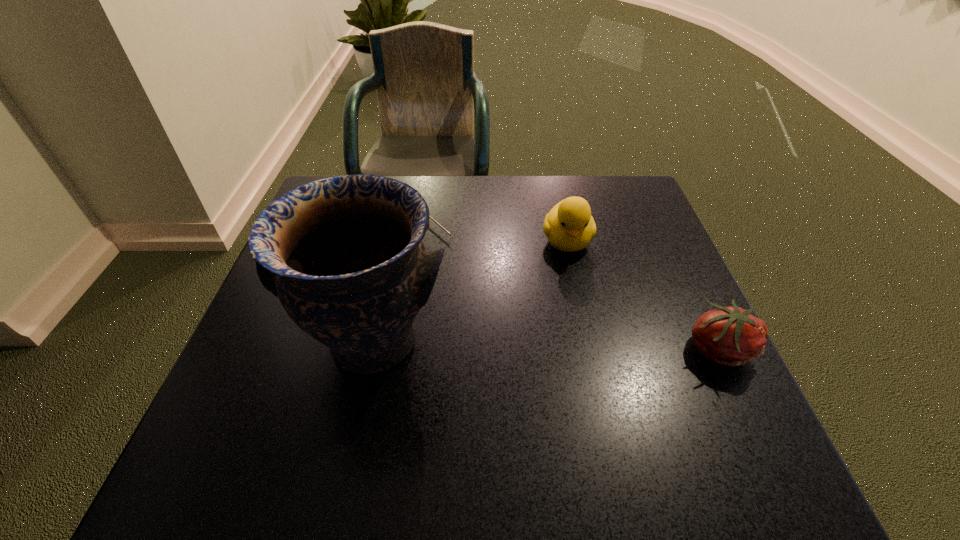
The height and width of the screenshot is (540, 960). In the image, there is a desktop. Find the location of `vacant space at the far right corner`. vacant space at the far right corner is located at coordinates (632, 175).

Identify the location of unoccupied position between the second shortest object and the tallest object. Image resolution: width=960 pixels, height=540 pixels. (546, 345).

At what (x,y) coordinates should I click in order to perform the action: click on unoccupied position between the second tallest object and the shortest object. Please return your answer as a coordinate pair (x, y). The image size is (960, 540). Looking at the image, I should click on (493, 228).

This screenshot has height=540, width=960. What are the coordinates of `vacant space that's between the third tallest object and the pottery` in the screenshot? It's located at (546, 345).

The height and width of the screenshot is (540, 960). Find the location of `vacant point located between the rightmost object and the duck`. vacant point located between the rightmost object and the duck is located at coordinates click(643, 294).

At what (x,y) coordinates should I click in order to perform the action: click on blank region between the duck and the rightmost object. Please return your answer as a coordinate pair (x, y). This screenshot has width=960, height=540. Looking at the image, I should click on (643, 294).

Find the location of a particular element. The image size is (960, 540). free area in between the tallest object and the tomato is located at coordinates (546, 345).

The width and height of the screenshot is (960, 540). I want to click on vacant space in between the rightmost object and the tallest object, so click(x=546, y=345).

Identify the location of vacant point located between the third object from left to right and the screwdriver. The image size is (960, 540). (493, 228).

At what (x,y) coordinates should I click in order to perform the action: click on free point between the screwdriver and the tomato. Please return your answer as a coordinate pair (x, y). The image size is (960, 540). Looking at the image, I should click on (569, 281).